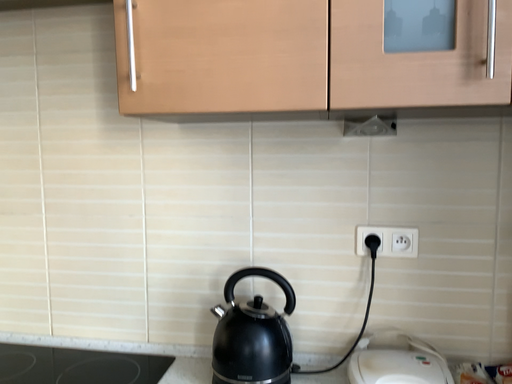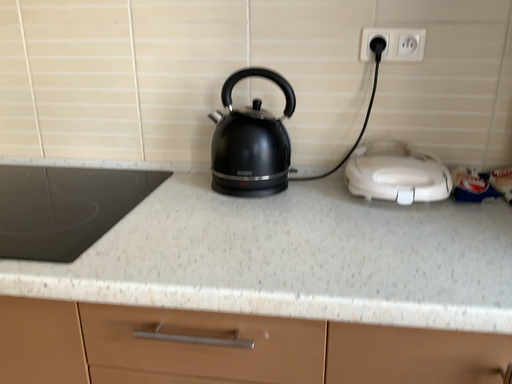
Question: How did the camera likely rotate when shooting the video?

Choices:
 (A) rotated upward
 (B) rotated downward

Answer: (B)